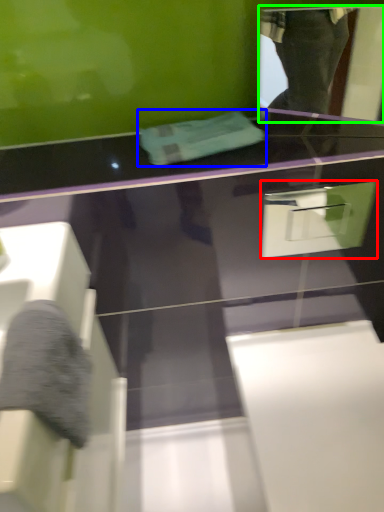
Question: Which is nearer to the drawer (highlighted by a red box)? towel (highlighted by a blue box) or mirror (highlighted by a green box).

Choices:
 (A) towel
 (B) mirror

Answer: (A)